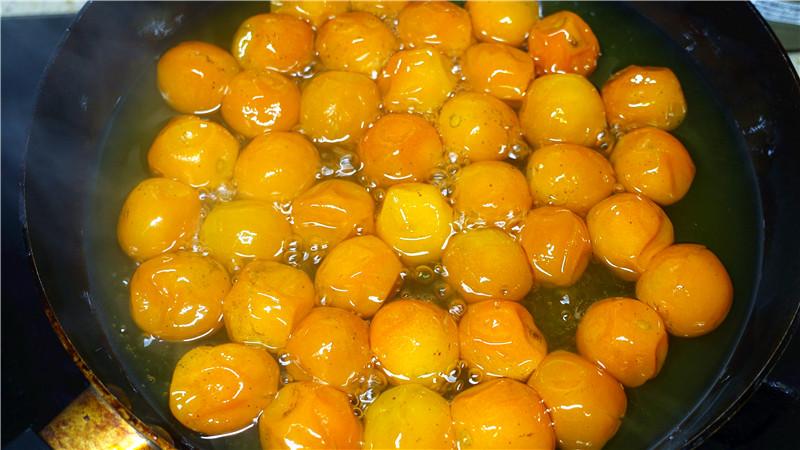
You are a GUI agent. You are given a task and a screenshot of the screen. Output one action in this format:
    pyautogui.click(x=<x>, y=<y>)
    Task: Click on the bottle
    
    Given the screenshot: What is the action you would take?
    pyautogui.click(x=788, y=29)